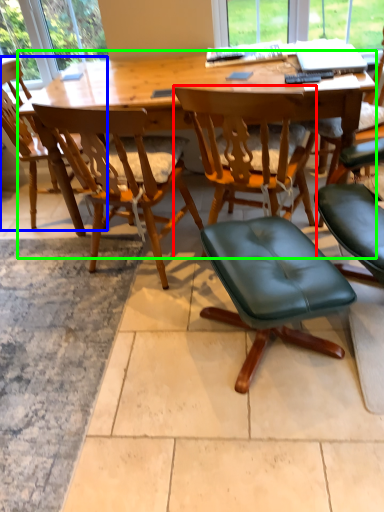
Question: Which is nearer to the chair (highlighted by a red box)? chair (highlighted by a blue box) or desk (highlighted by a green box).

Choices:
 (A) chair
 (B) desk

Answer: (B)